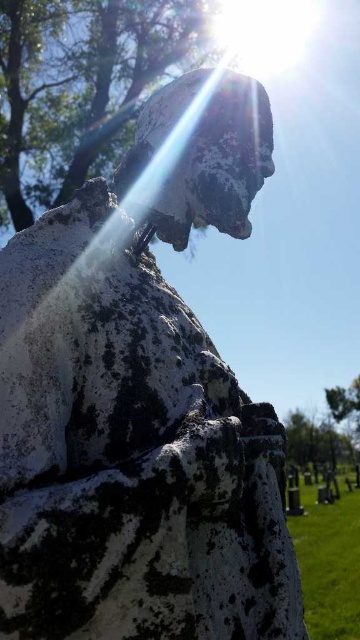
Question: Does green leafy tree at upper center have a smaller size compared to green leafy tree at center?

Choices:
 (A) yes
 (B) no

Answer: (B)

Question: Which of the following is the farthest from the observer?

Choices:
 (A) (342, 448)
 (B) (92, 99)

Answer: (A)

Question: Is green leafy tree at upper center wider than green leafy tree at center?

Choices:
 (A) yes
 (B) no

Answer: (A)

Question: Which object appears closest to the camera in this image?

Choices:
 (A) green leafy tree at center
 (B) green leafy tree at upper center

Answer: (B)

Question: Considering the relative positions of green leafy tree at upper center and green leafy tree at center in the image provided, where is green leafy tree at upper center located with respect to green leafy tree at center?

Choices:
 (A) right
 (B) left

Answer: (B)